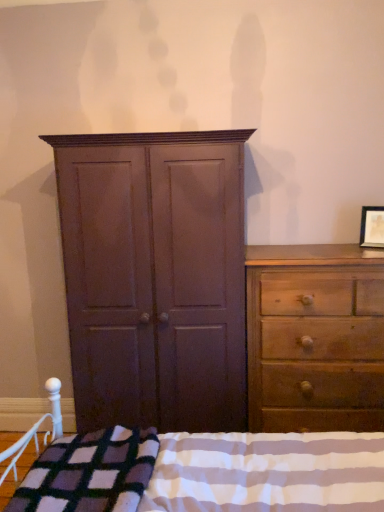
Question: Considering the positions of matte wooden picture frame at upper right and plaid wool blanket at lower center in the image, is matte wooden picture frame at upper right taller or shorter than plaid wool blanket at lower center?

Choices:
 (A) short
 (B) tall

Answer: (A)

Question: From the image's perspective, relative to plaid wool blanket at lower center, is matte wooden picture frame at upper right above or below?

Choices:
 (A) above
 (B) below

Answer: (A)

Question: Estimate the real-world distances between objects in this image. Which object is closer to the plaid wool blanket at lower center?

Choices:
 (A) matte wooden picture frame at upper right
 (B) plush purple blanket at lower left
 (C) matte brown cupboard at center
 (D) wooden dresser at right

Answer: (B)

Question: Which is farther from the plaid wool blanket at lower center?

Choices:
 (A) matte brown cupboard at center
 (B) plush purple blanket at lower left
 (C) matte wooden picture frame at upper right
 (D) wooden dresser at right

Answer: (C)